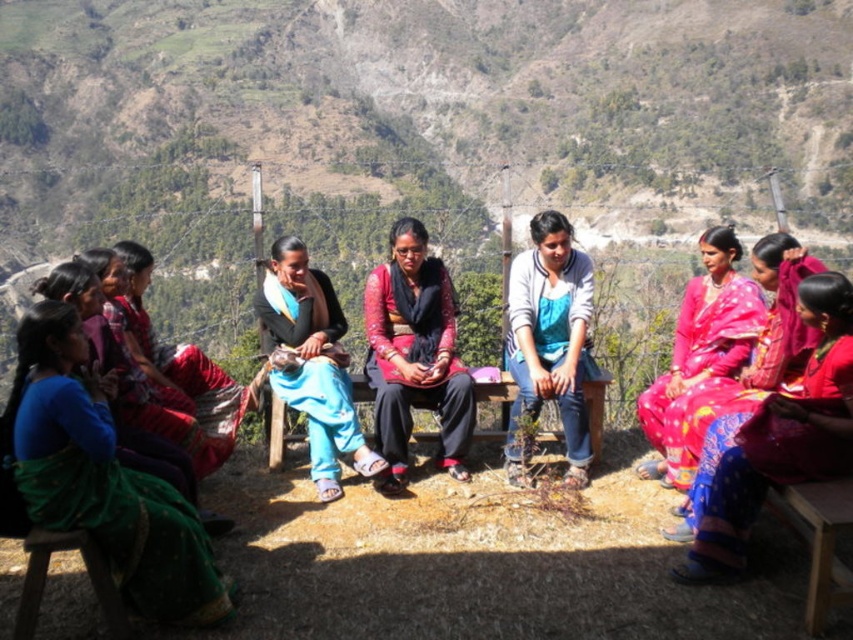
Question: Estimate the real-world distances between objects in this image. Which object is farther from the green fabric saree at left?

Choices:
 (A) blue cotton pants at center
 (B) green silk saree at left

Answer: (B)

Question: Is vivid red saree at right smaller than blue cotton pants at center?

Choices:
 (A) no
 (B) yes

Answer: (B)

Question: Which point is closer to the camera?

Choices:
 (A) (276, 456)
 (B) (254, 301)
 (C) (209, 424)
 (D) (398, 220)

Answer: (C)

Question: Where is green silk saree at left located in relation to vivid red saree at right in the image?

Choices:
 (A) above
 (B) below

Answer: (B)

Question: Which point is closer to the camera taking this photo?

Choices:
 (A) (451, 376)
 (B) (654, 461)
 (C) (775, 394)
 (D) (210, 449)

Answer: (C)

Question: Does matte black pants at center appear on the left side of blue cotton pants at center?

Choices:
 (A) yes
 (B) no

Answer: (B)